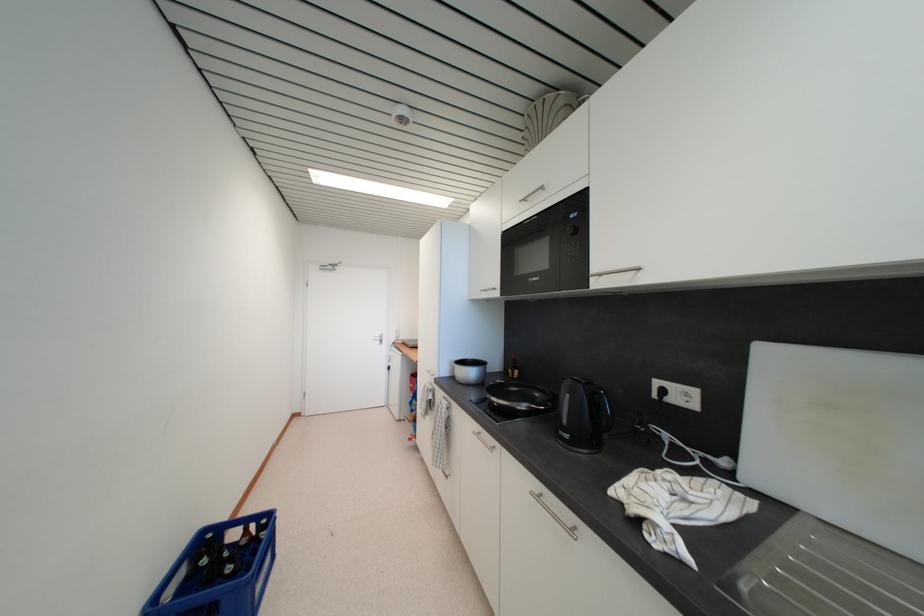
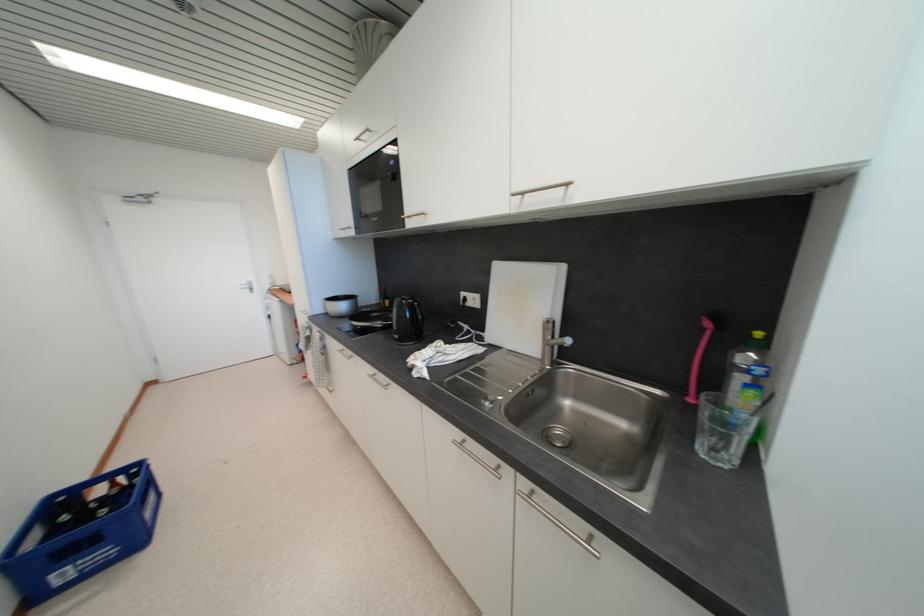
Where in the second image is the point corresponding to pixel 457 379 from the first image?

(332, 315)